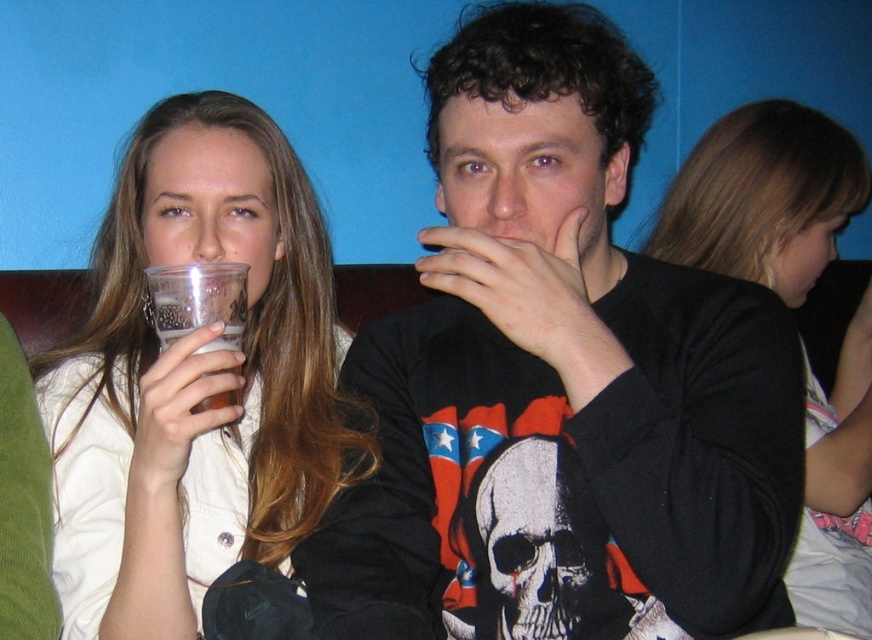
You are a tailor measuring a customer for a new outfit. You need to determine if the black matte sweatshirt at center can be worn over the translucent plastic cup at left. Based on their widths, can the sweatshirt accommodate the cup?

The black matte sweatshirt at center is wider than the translucent plastic cup at left, so the sweatshirt can accommodate the cup.

You are a bartender who needs to place a new drink order at the bar. The clear plastic cup at left is already on the counter. Where should you place the new drink so it doesn not interfere with the existing cup?

The clear plastic cup at left is located at point (195, 380). To avoid interference, place the new drink away from these coordinates.

Looking at this image, you are a delivery person who needs to place a small package between the black matte sweatshirt at center and the translucent plastic cup at left. Can you fit it there?

The black matte sweatshirt at center is larger in size than the translucent plastic cup at left, so there might be enough space between them to fit a small package.